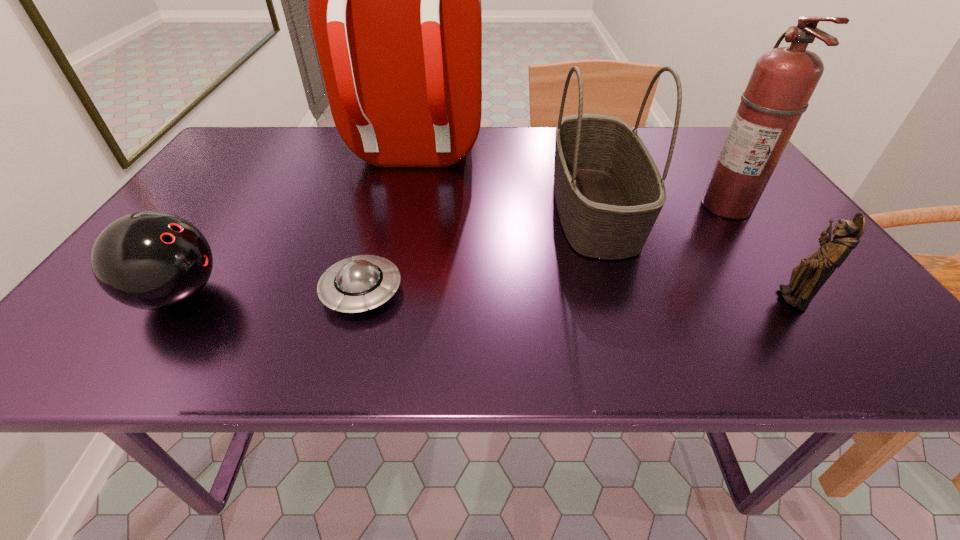
Find the location of a particular element. This screenshot has width=960, height=540. backpack is located at coordinates (394, 0).

The height and width of the screenshot is (540, 960). In order to click on fire extinguisher in this screenshot , I will do `click(783, 80)`.

Find the location of `the third object from right to left`. the third object from right to left is located at coordinates (609, 192).

Locate an element on the screen. The width and height of the screenshot is (960, 540). the third tallest object is located at coordinates (609, 192).

Locate an element on the screen. This screenshot has height=540, width=960. figurine is located at coordinates (807, 278).

You are a GUI agent. You are given a task and a screenshot of the screen. Output one action in this format:
    pyautogui.click(x=<x>, y=<y>)
    Task: Click on the leftmost object
    The width and height of the screenshot is (960, 540).
    Given the screenshot: What is the action you would take?
    pyautogui.click(x=150, y=260)

Where is `the shortest object`? the shortest object is located at coordinates (352, 285).

Locate an element on the screen. Image resolution: width=960 pixels, height=540 pixels. free space located on the strap side of the tallest object is located at coordinates (397, 218).

Locate an element on the screen. This screenshot has height=540, width=960. vacant space located on the front-facing side of the fire extinguisher is located at coordinates (623, 207).

Locate an element on the screen. This screenshot has width=960, height=540. free region located on the front-facing side of the fire extinguisher is located at coordinates (636, 207).